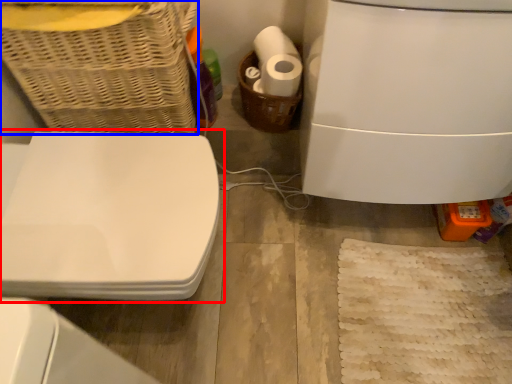
Question: Which point is further to the camera, toilet (highlighted by a red box) or basket (highlighted by a blue box)?

Choices:
 (A) toilet
 (B) basket

Answer: (A)